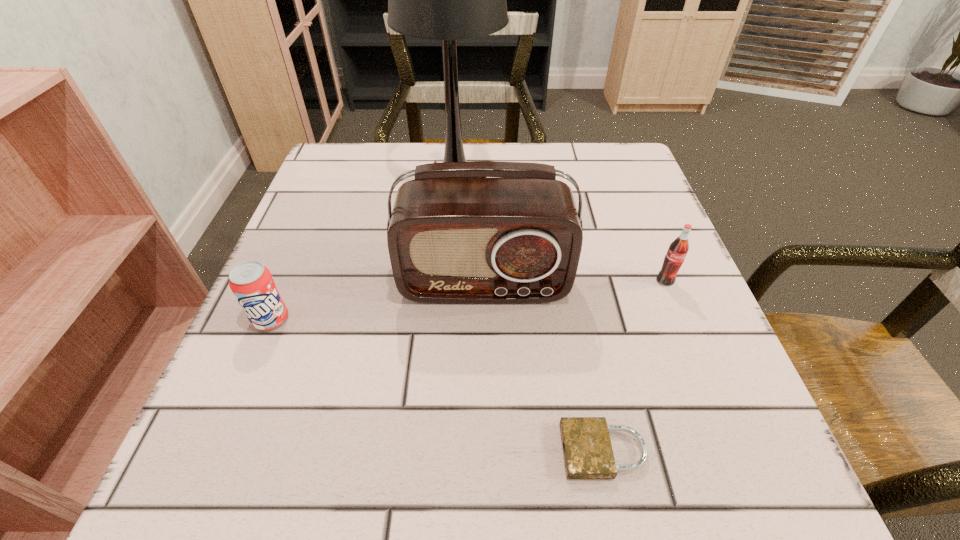
Where is `free region located on the front panel of the fourth shortest object`? This screenshot has width=960, height=540. free region located on the front panel of the fourth shortest object is located at coordinates (486, 476).

This screenshot has width=960, height=540. In order to click on blank area located 0.120m on the label of the farther soda can in this screenshot , I will do `click(690, 343)`.

Find the location of a particular element. Image resolution: width=960 pixels, height=540 pixels. vacant space situated on the surface of the shorter soda can is located at coordinates (222, 435).

Locate an element on the screen. The height and width of the screenshot is (540, 960). blank area located 0.220m on the keyhole side of the shortest object is located at coordinates (395, 451).

The width and height of the screenshot is (960, 540). Find the location of `free space located on the keyhole side of the shortest object`. free space located on the keyhole side of the shortest object is located at coordinates (265, 451).

Locate an element on the screen. free space located 0.190m on the keyhole side of the shortest object is located at coordinates (418, 451).

Where is `object situated at the far edge`? This screenshot has width=960, height=540. object situated at the far edge is located at coordinates (448, 0).

At what (x,y) coordinates should I click in order to perform the action: click on object situated at the near edge. Please return your answer as a coordinate pair (x, y). The height and width of the screenshot is (540, 960). Looking at the image, I should click on (588, 454).

You are a GUI agent. You are given a task and a screenshot of the screen. Output one action in this format:
    pyautogui.click(x=<x>, y=<y>)
    Task: Click on the object located at the left edge
    This screenshot has height=540, width=960.
    Given the screenshot: What is the action you would take?
    pyautogui.click(x=252, y=284)

Locate an element on the screen. The image size is (960, 540). soda bottle present at the right edge is located at coordinates (678, 249).